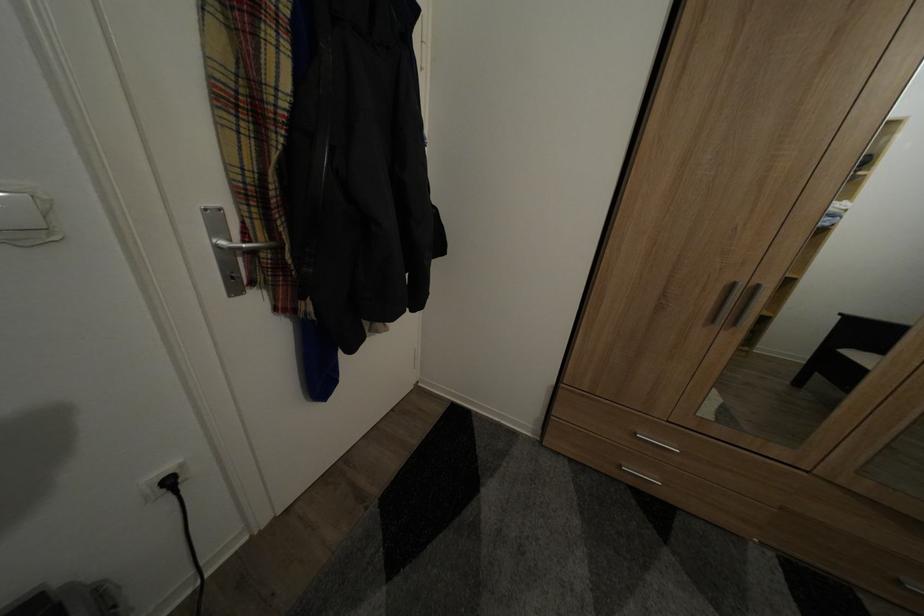
Where would you press the white light switch? Please return your answer as a coordinate pair (x, y).

(22, 215)